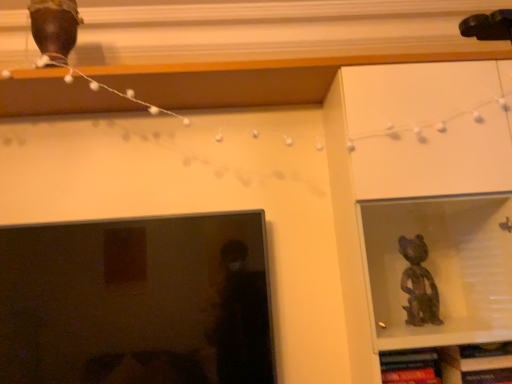
At what (x,y) coordinates should I click in order to perform the action: click on free space above matte black tv at left (from a real-world perspective). Please return your answer as a coordinate pair (x, y). The height and width of the screenshot is (384, 512). Looking at the image, I should click on (94, 214).